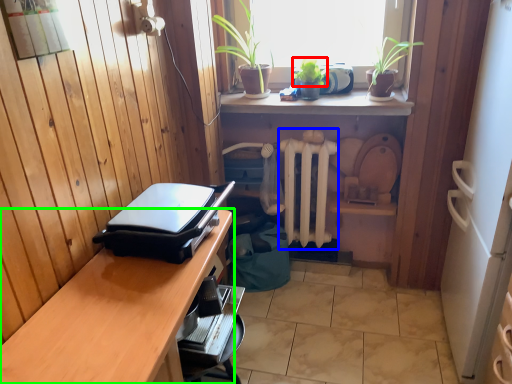
Question: Which is nearer to the plant (highlighted by a red box)? radiator (highlighted by a blue box) or desk (highlighted by a green box).

Choices:
 (A) radiator
 (B) desk

Answer: (A)